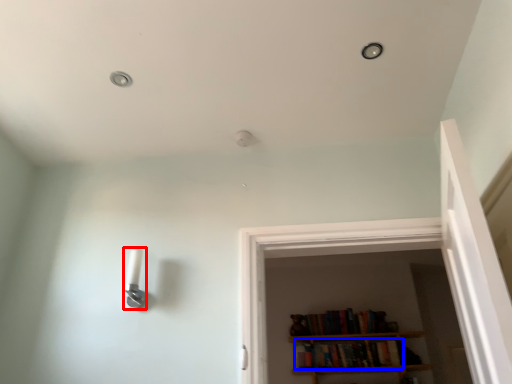
Question: Which object appears farthest to the camera in this image, light fixture (highlighted by a red box) or book (highlighted by a blue box)?

Choices:
 (A) light fixture
 (B) book

Answer: (B)